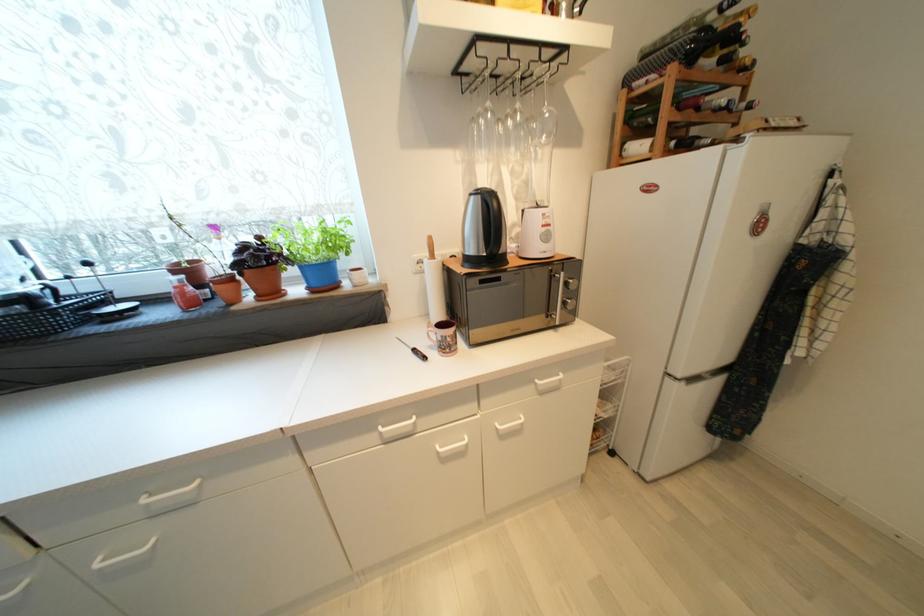
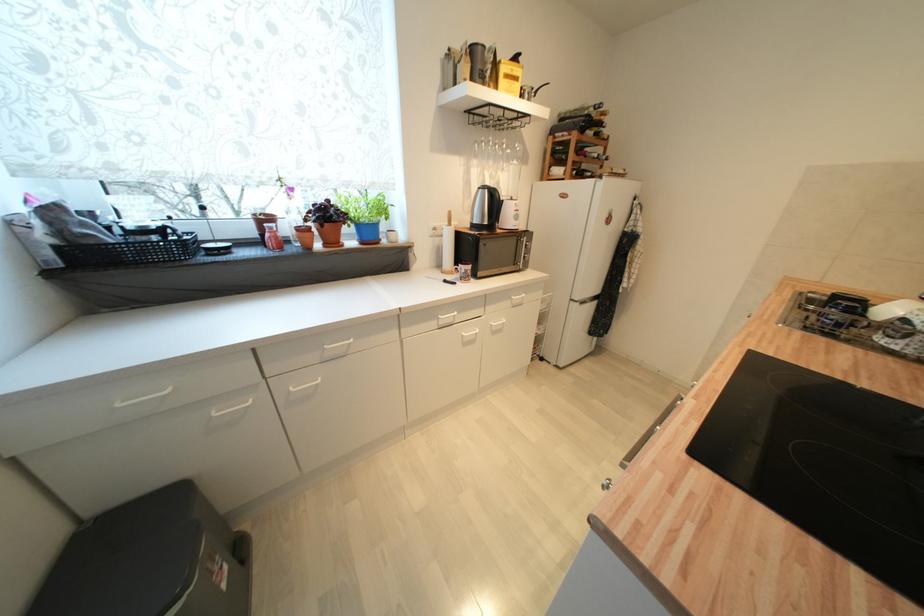
In the second image, find the point that corresponds to point 264,299 in the first image.

(331, 246)